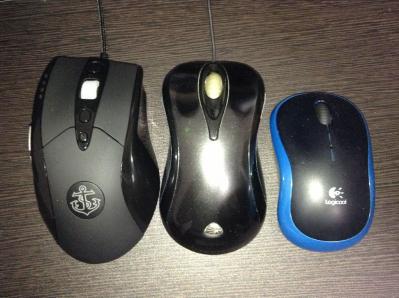
This screenshot has width=399, height=298. Find the location of `wireless mouse`. wireless mouse is located at coordinates (319, 171).